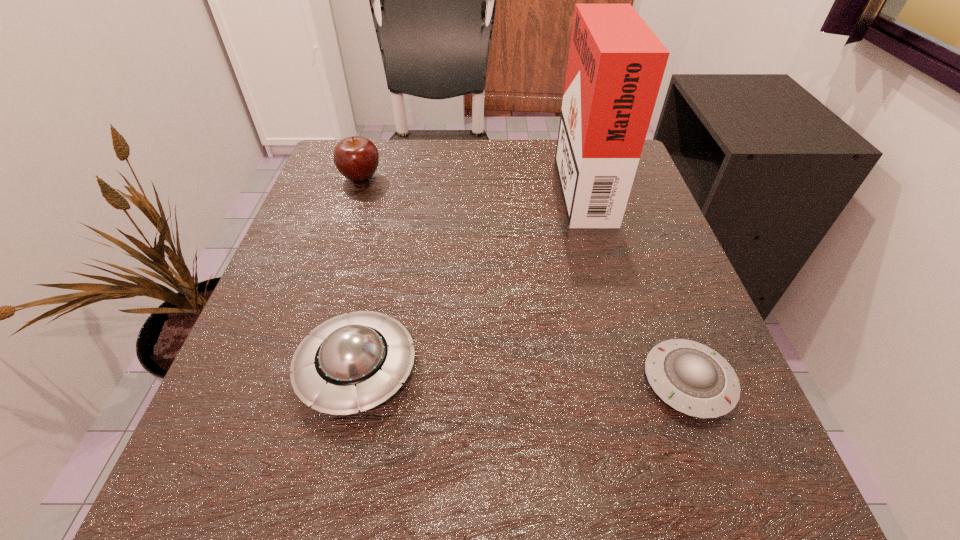
Identify the location of cigarette case. (616, 63).

The height and width of the screenshot is (540, 960). Find the location of `apple`. apple is located at coordinates (356, 158).

At what (x,y) coordinates should I click in order to perform the action: click on the third tallest object. Please return your answer as a coordinate pair (x, y). This screenshot has width=960, height=540. Looking at the image, I should click on (356, 361).

Locate an element on the screen. This screenshot has width=960, height=540. the taller saucer is located at coordinates (356, 361).

Locate an element on the screen. Image resolution: width=960 pixels, height=540 pixels. the shorter saucer is located at coordinates coord(692,378).

Where is `the right saucer`? The height and width of the screenshot is (540, 960). the right saucer is located at coordinates (692, 378).

Image resolution: width=960 pixels, height=540 pixels. I want to click on vacant space located on the front-facing side of the tallest object, so coord(478,183).

I want to click on vacant space located on the front-facing side of the tallest object, so pos(446,183).

I want to click on vacant area situated 0.330m on the front-facing side of the tallest object, so click(x=410, y=183).

Where is `free space located on the right of the apple`? free space located on the right of the apple is located at coordinates (444, 177).